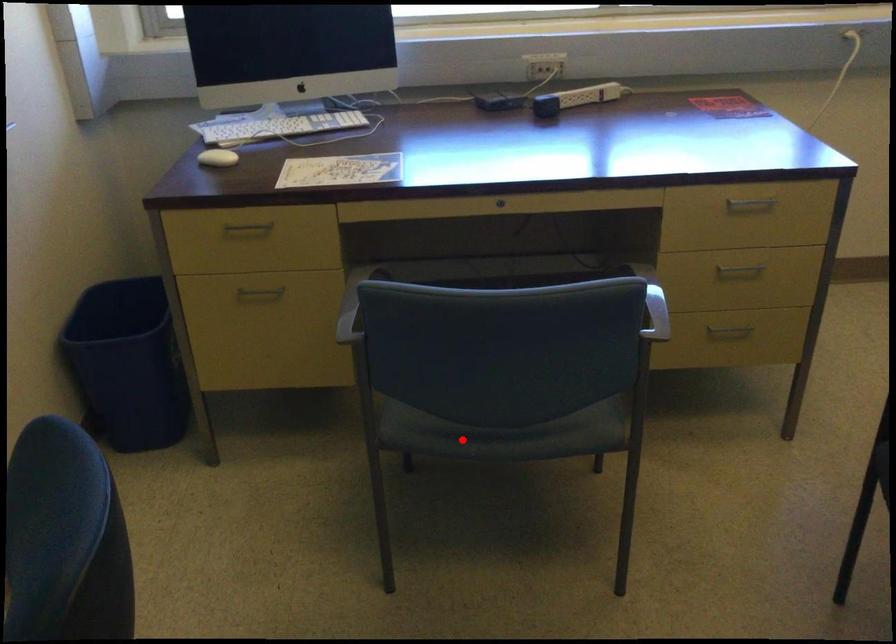
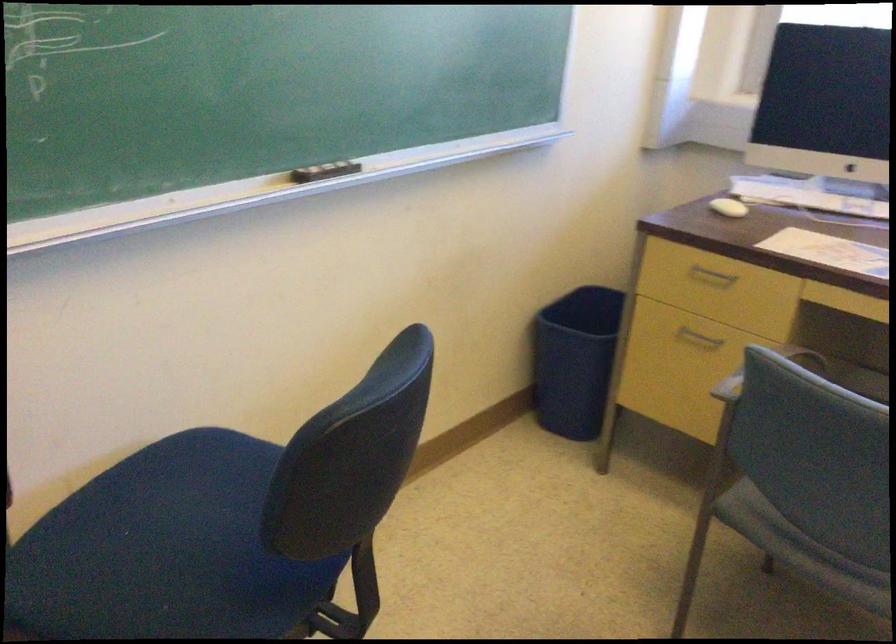
Locate, in the second image, the point that corresponds to the highlighted location in the first image.

(800, 549)